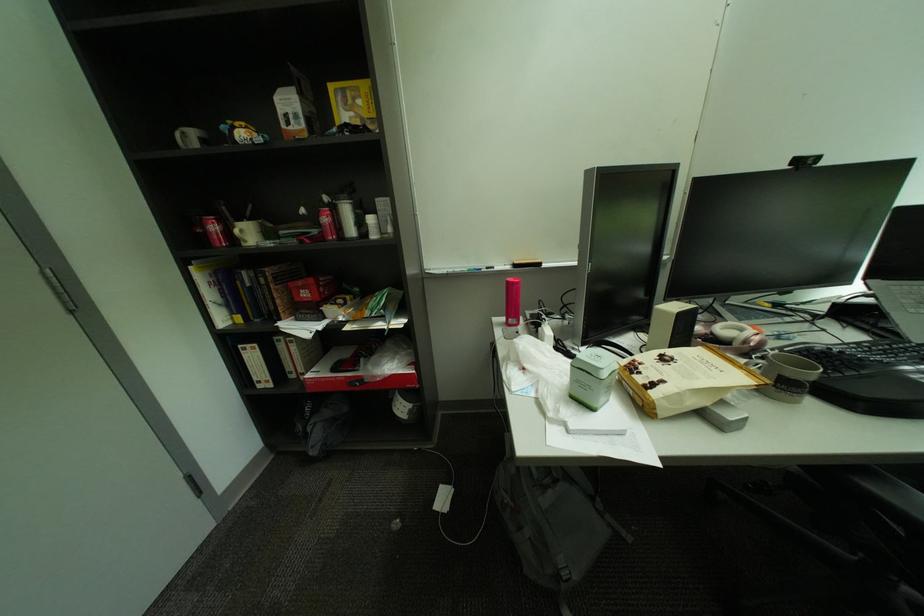
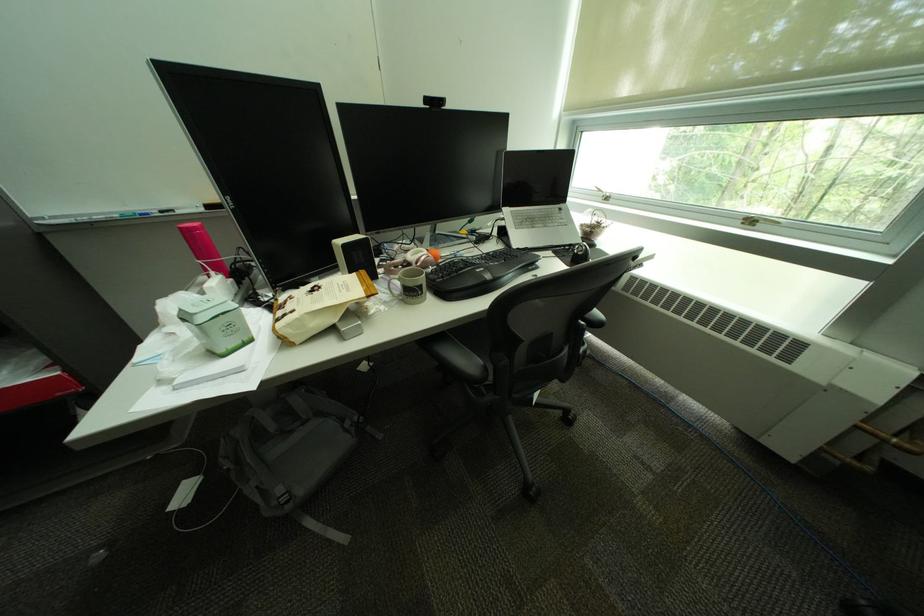
Where in the second image is the point corresponding to (x=689, y=395) from the first image?

(309, 321)